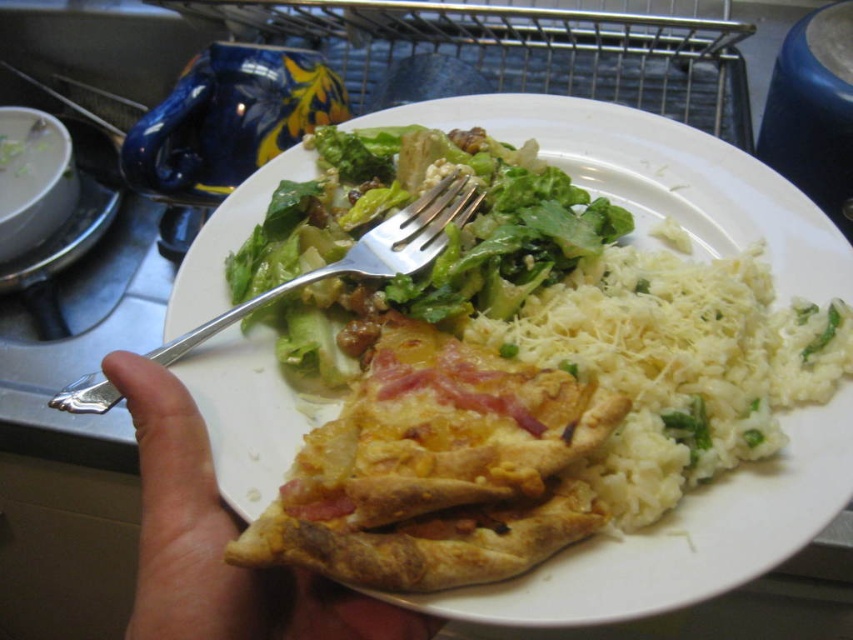
Question: Does white matte plate at center appear under green leafymaterial/textureobject at upper center?

Choices:
 (A) no
 (B) yes

Answer: (B)

Question: Is white matte plate at center positioned behind brown textured hand at lower left?

Choices:
 (A) yes
 (B) no

Answer: (A)

Question: Is white matte plate at center to the right of brown textured hand at lower left from the viewer's perspective?

Choices:
 (A) no
 (B) yes

Answer: (B)

Question: Which object appears farthest from the camera in this image?

Choices:
 (A) white matte plate at center
 (B) golden brown crispy omelet at center

Answer: (A)

Question: Which of the following is the closest to the observer?

Choices:
 (A) green leafymaterial/textureobject at upper center
 (B) silver metallic fork at upper center

Answer: (B)

Question: Which object is farther from the camera taking this photo?

Choices:
 (A) white fluffy rice at center-right
 (B) green leafymaterial/textureobject at upper center

Answer: (B)